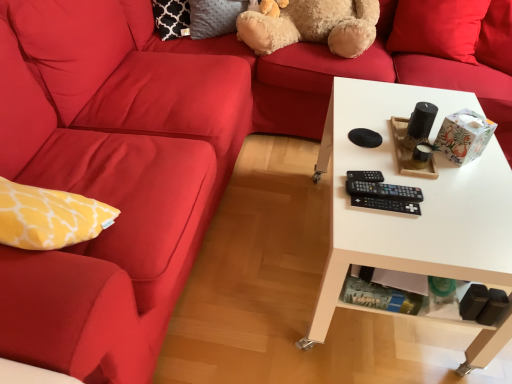
The height and width of the screenshot is (384, 512). I want to click on empty space that is to the right of black plastic remote at center, which ranks as the 2th control in back-to-front order, so click(443, 196).